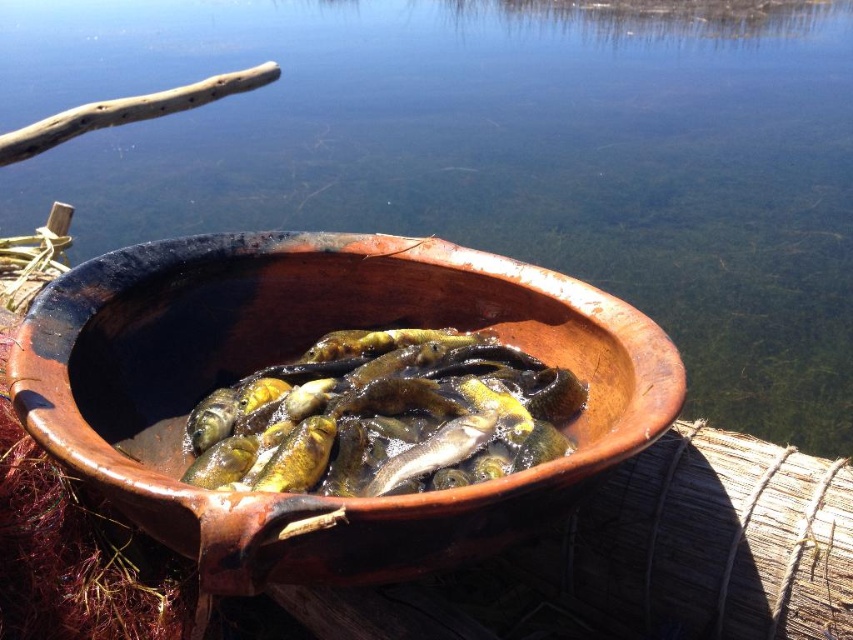
Question: Can you confirm if yellow-green scales at center is positioned above shiny silver fish at center?

Choices:
 (A) yes
 (B) no

Answer: (A)

Question: Which point is closer to the camera taking this photo?

Choices:
 (A) (624, 406)
 (B) (430, 168)
 (C) (392, 477)
 (D) (525, 362)

Answer: (C)

Question: Which object is farther from the camera taking this photo?

Choices:
 (A) shiny silver fish at center
 (B) clear water at center

Answer: (A)

Question: Estimate the real-world distances between objects in this image. Which object is closer to the clear water at center?

Choices:
 (A) yellow-green scales at center
 (B) brown clay bowl at center
 (C) shiny silver fish at center

Answer: (A)

Question: Is clear water at center thinner than brown clay bowl at center?

Choices:
 (A) no
 (B) yes

Answer: (A)

Question: Observing the image, what is the correct spatial positioning of clear water at center in reference to shiny golden fish at center?

Choices:
 (A) right
 (B) left

Answer: (A)